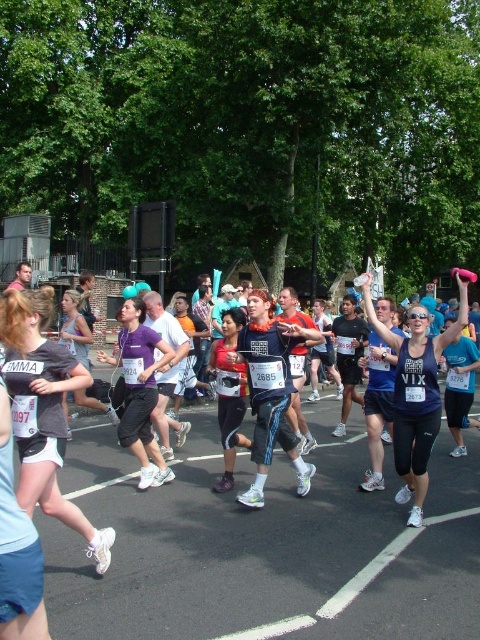
You are a photographer at the marathon event and want to capture a photo that includes both the blue fabric tank top at center and the purple fabric shirt at center. Which clothing item will appear taller in the photo?

The blue fabric tank top at center will appear taller in the photo because it has a greater height compared to the purple fabric shirt at center.

You are a photographer at the marathon and want to capture both the matte gray tank top at center and the blue fabric tank top at center in a single frame. Which runner should you focus on first to ensure both are in the shot?

The matte gray tank top at center has a lesser width compared to blue fabric tank top at center, so you should focus on the blue fabric tank top at center first since it takes up more space in the frame, ensuring both runners are captured.

You are a photographer standing at the starting line of the marathon. You want to take a photo that includes both the point at (x=408, y=362) and the point at (x=190, y=371). Which point will appear closer to the bottom edge of your photo?

The point at (x=190, y=371) will appear closer to the bottom edge of the photo because it is further away from the camera compared to the point at (x=408, y=362).